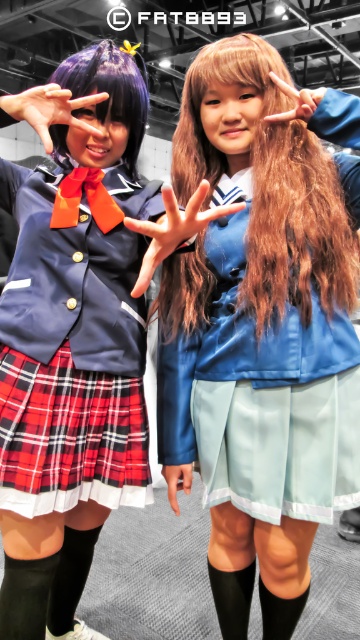
Question: Is light blue satin skirt at center above red plaid skirt at lower left?

Choices:
 (A) yes
 (B) no

Answer: (B)

Question: Which point appears closest to the camera in this image?

Choices:
 (A) (253, 496)
 (B) (272, 88)

Answer: (B)

Question: Does shiny brown hair at center lie behind purple silky hair at upper left?

Choices:
 (A) yes
 (B) no

Answer: (B)

Question: Can you confirm if light blue satin skirt at center is thinner than red plaid skirt at lower left?

Choices:
 (A) no
 (B) yes

Answer: (A)

Question: Based on their relative distances, which object is farther from the matte blue uniform at center?

Choices:
 (A) shiny brown hair at center
 (B) red plaid skirt at lower left

Answer: (A)

Question: Which of the following is the farthest from the observer?

Choices:
 (A) matte blue uniform at center
 (B) shiny brown hair at center
 (C) red plaid skirt at lower left
 (D) satin blue dress at center

Answer: (C)